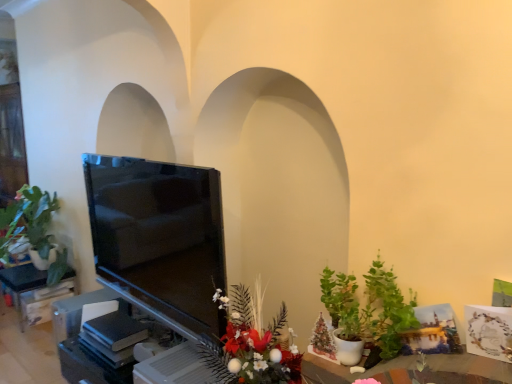
This screenshot has height=384, width=512. I want to click on matte black tv at left, so click(x=22, y=284).

Where is `glossy floral arrangement at lower center`? The image size is (512, 384). glossy floral arrangement at lower center is located at coordinates (249, 345).

Describe the element at coordinates (29, 220) in the screenshot. The height and width of the screenshot is (384, 512). I see `green matte plant at left, the 2th houseplant positioned from the front` at that location.

Where is `matte black tv at left`? The width and height of the screenshot is (512, 384). matte black tv at left is located at coordinates (22, 284).

Is glossy floral arrangement at lower center not inside green matte plant at lower right, the 1th houseplant viewed from the right?

That's correct, glossy floral arrangement at lower center is outside of green matte plant at lower right, the 1th houseplant viewed from the right.

From the image's perspective, which object appears higher, glossy floral arrangement at lower center or green matte plant at lower right, the 1th houseplant viewed from the right?

green matte plant at lower right, the 1th houseplant viewed from the right, from the image's perspective.

Is glossy floral arrangement at lower center oriented away from green matte plant at lower right, the 2th houseplant positioned from the back?

glossy floral arrangement at lower center does not have its back to green matte plant at lower right, the 2th houseplant positioned from the back.

How different are the orientations of matte black tv at left and green matte plant at left, the first houseplant when ordered from back to front, in degrees?

The facing directions of matte black tv at left and green matte plant at left, the first houseplant when ordered from back to front, are 4.23 degrees apart.

Is matte black tv at left not inside green matte plant at left, arranged as the first houseplant when viewed from the left?

Yes, matte black tv at left is outside of green matte plant at left, arranged as the first houseplant when viewed from the left.

Between matte black tv at left and green matte plant at left, arranged as the first houseplant when viewed from the left, which one has smaller size?

matte black tv at left.

Could you tell me if matte black tv at left is turned towards green matte plant at left, arranged as the first houseplant when viewed from the left?

No, matte black tv at left is not aimed at green matte plant at left, arranged as the first houseplant when viewed from the left.

In the scene shown: Does green matte plant at lower right, the 1th houseplant viewed from the right, contain matte black tv at left?

No, matte black tv at left is not inside green matte plant at lower right, the 1th houseplant viewed from the right.

Is the depth of green matte plant at lower right, the 2th houseplant positioned from the back, greater than that of matte black tv at left?

No, it is in front of matte black tv at left.

Does green matte plant at lower right, the 2th houseplant viewed from the left, have a greater height compared to matte black tv at left?

Indeed, green matte plant at lower right, the 2th houseplant viewed from the left, has a greater height compared to matte black tv at left.

Consider the image. Would you consider green matte plant at lower right, acting as the 1th houseplant starting from the front, to be distant from matte black tv at left?

green matte plant at lower right, acting as the 1th houseplant starting from the front, is far away from matte black tv at left.

Is green matte plant at lower right, the 1th houseplant viewed from the right, at the back of green matte plant at left, arranged as the first houseplant when viewed from the left?

No, green matte plant at left, arranged as the first houseplant when viewed from the left, is not facing the opposite direction of green matte plant at lower right, the 1th houseplant viewed from the right.

Considering the sizes of objects green matte plant at left, arranged as the first houseplant when viewed from the left, and green matte plant at lower right, the 1th houseplant viewed from the right, in the image provided, who is wider, green matte plant at left, arranged as the first houseplant when viewed from the left, or green matte plant at lower right, the 1th houseplant viewed from the right,?

With larger width is green matte plant at left, arranged as the first houseplant when viewed from the left.

Is green matte plant at left, the 2th houseplant positioned from the front, taller or shorter than green matte plant at lower right, acting as the 1th houseplant starting from the front?

Clearly, green matte plant at left, the 2th houseplant positioned from the front, is taller compared to green matte plant at lower right, acting as the 1th houseplant starting from the front.

Can you confirm if glossy floral arrangement at lower center is bigger than matte black tv at left?

Yes.

Considering the sizes of objects glossy floral arrangement at lower center and matte black tv at left in the image provided, who is wider, glossy floral arrangement at lower center or matte black tv at left?

matte black tv at left.

Which of these two, glossy floral arrangement at lower center or matte black tv at left, stands shorter?

Standing shorter between the two is matte black tv at left.

Which is farther from the camera, (284, 378) or (18, 302)?

The point (18, 302) is farther.

Between matte black tv at left and matte black tv at left, which one has larger size?

With larger size is matte black tv at left.

Would you say matte black tv at left is a long distance from matte black tv at left?

Indeed, matte black tv at left is not near matte black tv at left.

Can you confirm if matte black tv at left is thinner than matte black tv at left?

No.

Is matte black tv at left spatially inside matte black tv at left, or outside of it?

matte black tv at left is not inside matte black tv at left, it's outside.

Are green matte plant at lower right, the 1th houseplant viewed from the right, and glossy floral arrangement at lower center making contact?

No, green matte plant at lower right, the 1th houseplant viewed from the right, is not making contact with glossy floral arrangement at lower center.

Is green matte plant at lower right, the 1th houseplant viewed from the right, bigger or smaller than glossy floral arrangement at lower center?

Considering their sizes, green matte plant at lower right, the 1th houseplant viewed from the right, takes up less space than glossy floral arrangement at lower center.

Is green matte plant at lower right, the 2th houseplant viewed from the left, not inside glossy floral arrangement at lower center?

Indeed, green matte plant at lower right, the 2th houseplant viewed from the left, is completely outside glossy floral arrangement at lower center.

Based on their positions, is green matte plant at lower right, the 2th houseplant positioned from the back, located to the left or right of glossy floral arrangement at lower center?

Clearly, green matte plant at lower right, the 2th houseplant positioned from the back, is on the right of glossy floral arrangement at lower center in the image.

Locate an element on the screen. This screenshot has height=384, width=512. floral arrangement behind the green matte plant at lower right, the 2th houseplant viewed from the left is located at coordinates (249, 345).

Locate an element on the screen. television on the right of the green matte plant at left, arranged as the first houseplant when viewed from the left is located at coordinates (159, 238).

Estimate the real-world distances between objects in this image. Which object is further from green matte plant at lower right, the 2th houseplant viewed from the left, matte black tv at left or glossy floral arrangement at lower center?

matte black tv at left is further to green matte plant at lower right, the 2th houseplant viewed from the left.

Which object lies further to the anchor point green matte plant at lower right, the 2th houseplant positioned from the back, matte black tv at left or matte black tv at left?

matte black tv at left.

When comparing their distances from green matte plant at lower right, acting as the 1th houseplant starting from the front, does matte black tv at left or matte black tv at left seem closer?

matte black tv at left.

Estimate the real-world distances between objects in this image. Which object is closer to glossy floral arrangement at lower center, matte black tv at left or matte black tv at left?

matte black tv at left is closer to glossy floral arrangement at lower center.

Based on their spatial positions, is matte black tv at left or glossy floral arrangement at lower center further from green matte plant at lower right, the 2th houseplant positioned from the back?

The object further to green matte plant at lower right, the 2th houseplant positioned from the back, is matte black tv at left.

Which object lies nearer to the anchor point glossy floral arrangement at lower center, matte black tv at left or green matte plant at left, arranged as the first houseplant when viewed from the left?

Among the two, green matte plant at left, arranged as the first houseplant when viewed from the left, is located nearer to glossy floral arrangement at lower center.

When comparing their distances from glossy floral arrangement at lower center, does matte black tv at left or green matte plant at left, the first houseplant when ordered from back to front, seem further?

Based on the image, green matte plant at left, the first houseplant when ordered from back to front, appears to be further to glossy floral arrangement at lower center.

Considering their positions, is matte black tv at left positioned further to green matte plant at left, the first houseplant when ordered from back to front, than glossy floral arrangement at lower center?

The object further to green matte plant at left, the first houseplant when ordered from back to front, is glossy floral arrangement at lower center.

I want to click on television situated between matte black tv at left and green matte plant at lower right, the 1th houseplant viewed from the right, from left to right, so click(159, 238).

Image resolution: width=512 pixels, height=384 pixels. Find the location of `floral arrangement between matte black tv at left and green matte plant at lower right, acting as the 1th houseplant starting from the front, in the horizontal direction`. floral arrangement between matte black tv at left and green matte plant at lower right, acting as the 1th houseplant starting from the front, in the horizontal direction is located at coordinates (249, 345).

Where is `television situated between green matte plant at left, the 2th houseplant positioned from the front, and glossy floral arrangement at lower center from left to right`? This screenshot has height=384, width=512. television situated between green matte plant at left, the 2th houseplant positioned from the front, and glossy floral arrangement at lower center from left to right is located at coordinates (159, 238).

Where is `floral arrangement between green matte plant at left, the first houseplant when ordered from back to front, and green matte plant at lower right, the 1th houseplant viewed from the right`? This screenshot has width=512, height=384. floral arrangement between green matte plant at left, the first houseplant when ordered from back to front, and green matte plant at lower right, the 1th houseplant viewed from the right is located at coordinates click(249, 345).